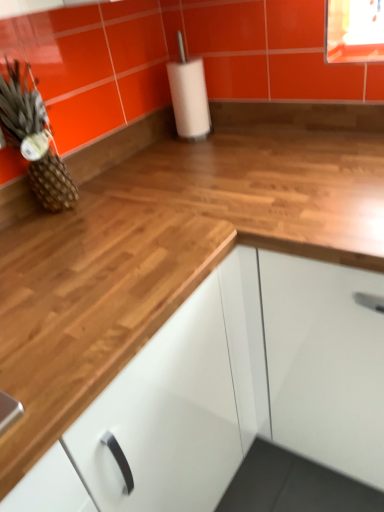
Question: Considering the positions of white glossy cabinet at center and brown textured pineapple at left in the image, is white glossy cabinet at center bigger or smaller than brown textured pineapple at left?

Choices:
 (A) big
 (B) small

Answer: (A)

Question: Is white glossy cabinet at center inside the boundaries of brown textured pineapple at left, or outside?

Choices:
 (A) outside
 (B) inside

Answer: (A)

Question: From the image's perspective, is white glossy cabinet at center above or below brown textured pineapple at left?

Choices:
 (A) below
 (B) above

Answer: (A)

Question: In terms of width, does brown textured pineapple at left look wider or thinner when compared to white glossy cabinet at center?

Choices:
 (A) thin
 (B) wide

Answer: (A)

Question: Considering the positions of brown textured pineapple at left and white glossy cabinet at center in the image, is brown textured pineapple at left bigger or smaller than white glossy cabinet at center?

Choices:
 (A) small
 (B) big

Answer: (A)

Question: From a real-world perspective, is brown textured pineapple at left positioned above or below white glossy cabinet at center?

Choices:
 (A) above
 (B) below

Answer: (A)

Question: From their relative heights in the image, would you say brown textured pineapple at left is taller or shorter than white glossy cabinet at center?

Choices:
 (A) tall
 (B) short

Answer: (B)